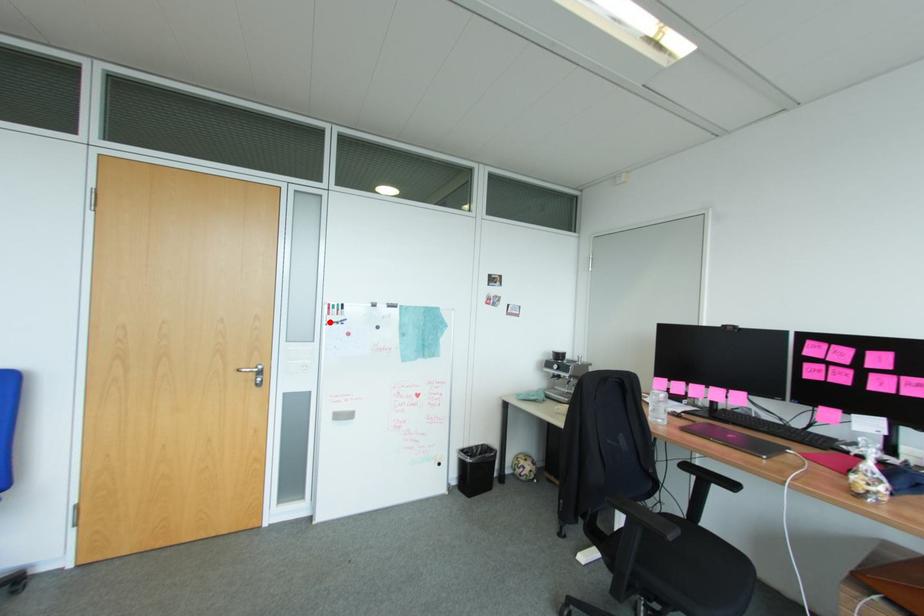
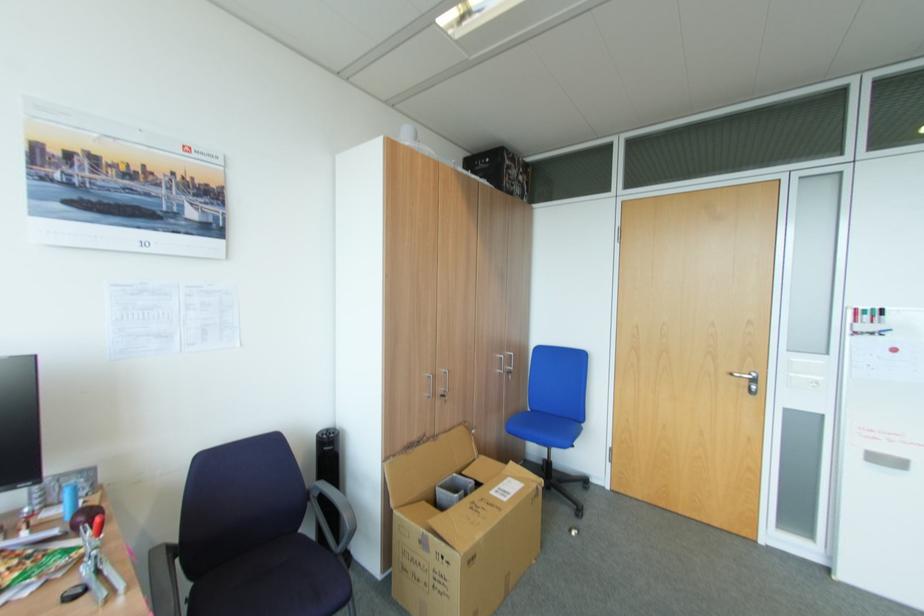
Where in the second image is the point corresponding to the highlighted location from the first image?

(856, 333)